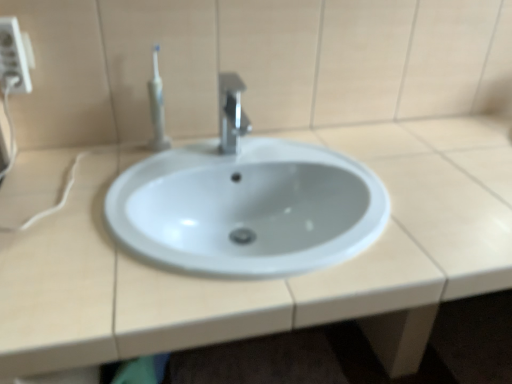
The width and height of the screenshot is (512, 384). I want to click on vacant space to the right of white plastic toothbrush at upper left, so click(222, 151).